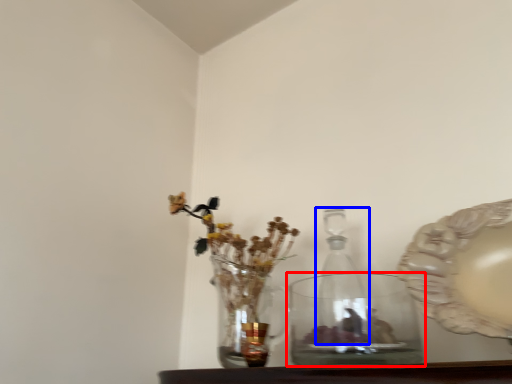
Question: Which object appears closest to the camera in this image, vase (highlighted by a red box) or glass bottle (highlighted by a blue box)?

Choices:
 (A) vase
 (B) glass bottle

Answer: (A)